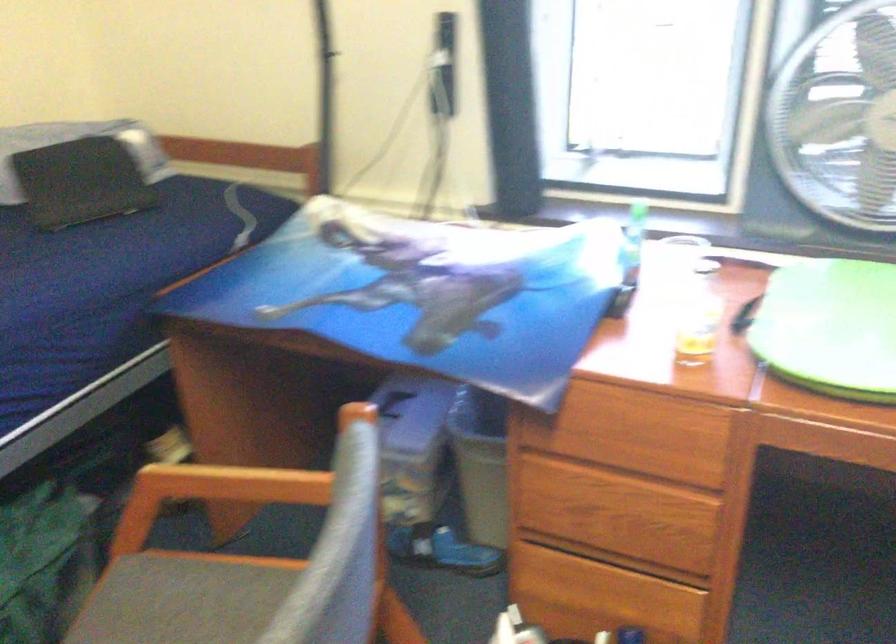
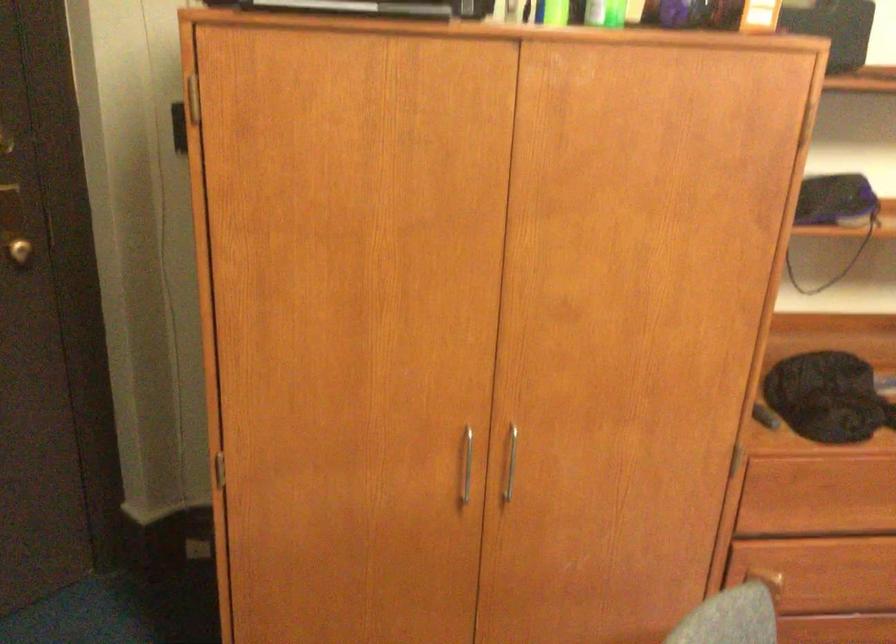
Based on the continuous images, in which direction is the camera rotating?

The camera's rotation is toward left-down.